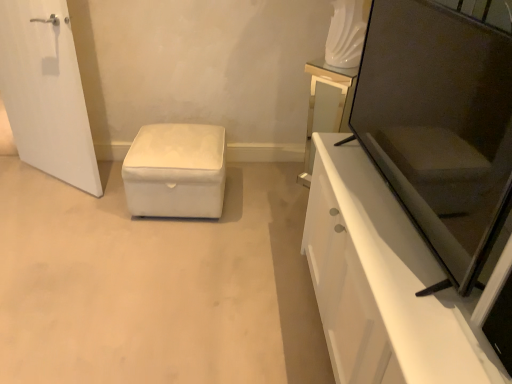
Question: From the image's perspective, is white glossy cabinet at right located beneath white fabric ottoman at center?

Choices:
 (A) no
 (B) yes

Answer: (B)

Question: Considering the relative positions of white glossy cabinet at right and white fabric ottoman at center in the image provided, is white glossy cabinet at right behind white fabric ottoman at center?

Choices:
 (A) no
 (B) yes

Answer: (A)

Question: Is white glossy cabinet at right looking in the opposite direction of white fabric ottoman at center?

Choices:
 (A) no
 (B) yes

Answer: (A)

Question: Is white glossy cabinet at right directly adjacent to white fabric ottoman at center?

Choices:
 (A) no
 (B) yes

Answer: (A)

Question: Could you tell me if white glossy cabinet at right is turned towards white fabric ottoman at center?

Choices:
 (A) yes
 (B) no

Answer: (B)

Question: Do you think white fabric ottoman at center is within white glossy cabinet at right, or outside of it?

Choices:
 (A) outside
 (B) inside

Answer: (A)

Question: Is white fabric ottoman at center taller or shorter than white glossy cabinet at right?

Choices:
 (A) short
 (B) tall

Answer: (A)

Question: From the image's perspective, relative to white glossy cabinet at right, is white fabric ottoman at center above or below?

Choices:
 (A) above
 (B) below

Answer: (A)

Question: Looking at their shapes, would you say white fabric ottoman at center is wider or thinner than white glossy cabinet at right?

Choices:
 (A) wide
 (B) thin

Answer: (A)

Question: Considering their positions, is white glossy cabinet at right located in front of or behind matte black screen door at right?

Choices:
 (A) front
 (B) behind

Answer: (A)

Question: Considering the positions of white glossy cabinet at right and matte black screen door at right in the image, is white glossy cabinet at right bigger or smaller than matte black screen door at right?

Choices:
 (A) small
 (B) big

Answer: (B)

Question: Does point (467, 344) appear closer or farther from the camera than point (485, 137)?

Choices:
 (A) closer
 (B) farther

Answer: (B)

Question: From the image's perspective, is white glossy cabinet at right above or below matte black screen door at right?

Choices:
 (A) above
 (B) below

Answer: (B)

Question: In terms of width, does matte black screen door at right look wider or thinner when compared to matte glass vanity at upper right?

Choices:
 (A) wide
 (B) thin

Answer: (B)

Question: From the image's perspective, is matte black screen door at right positioned above or below matte glass vanity at upper right?

Choices:
 (A) above
 (B) below

Answer: (B)